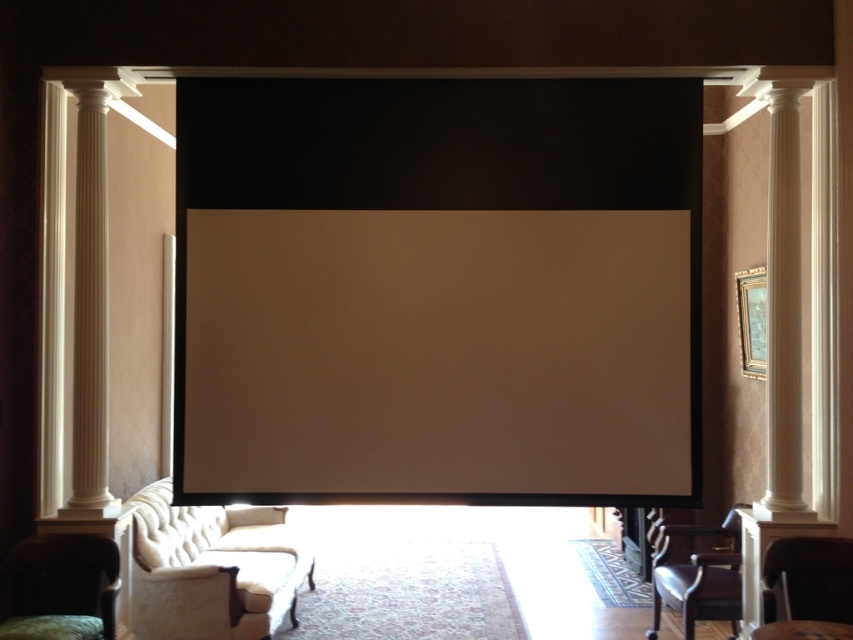
Question: Which point is farther to the camera?

Choices:
 (A) (776, 634)
 (B) (53, 332)
 (C) (27, 572)

Answer: (B)

Question: Is matte white screen at center closer to the viewer compared to matte white armchair at lower right?

Choices:
 (A) no
 (B) yes

Answer: (A)

Question: Is dark brown leather armchair at lower left positioned before dark brown leather armchair at lower right?

Choices:
 (A) yes
 (B) no

Answer: (A)

Question: Which point is closer to the camera taking this photo?

Choices:
 (A) (155, 500)
 (B) (53, 300)

Answer: (B)

Question: Among these objects, which one is nearest to the camera?

Choices:
 (A) dark brown leather armchair at lower right
 (B) matte white screen at center
 (C) white tufted fabric couch at lower left

Answer: (B)

Question: Can you confirm if white tufted fabric couch at lower left is positioned above matte white armchair at lower right?

Choices:
 (A) no
 (B) yes

Answer: (A)